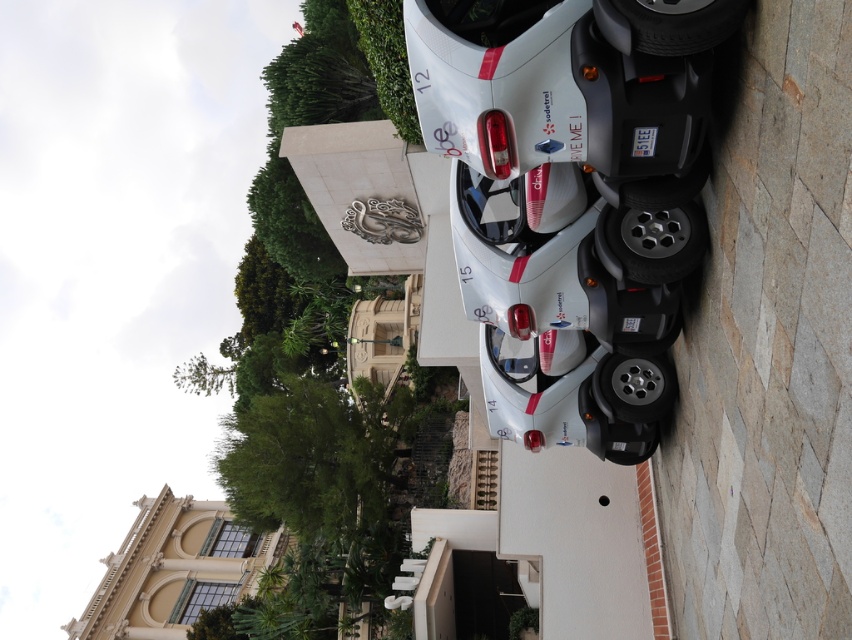
Question: Which of the following is the closest to the observer?

Choices:
 (A) (646, 388)
 (B) (653, 278)
 (C) (635, 35)

Answer: (C)

Question: Does black rubber tire at upper right have a larger size compared to metallic silver tire at center?

Choices:
 (A) yes
 (B) no

Answer: (B)

Question: Which of these objects is positioned closest to the metallic silver tire at center?

Choices:
 (A) black rubber tire at upper right
 (B) black rubber tire at lower right

Answer: (A)

Question: Can you confirm if black rubber tire at upper right is positioned below black rubber tire at lower right?

Choices:
 (A) yes
 (B) no

Answer: (B)

Question: Which object is farther from the camera taking this photo?

Choices:
 (A) metallic silver tire at center
 (B) black rubber tire at upper right
 (C) black rubber tire at lower right

Answer: (C)

Question: From the image, what is the correct spatial relationship of metallic silver tire at center in relation to black rubber tire at lower right?

Choices:
 (A) left
 (B) right

Answer: (A)